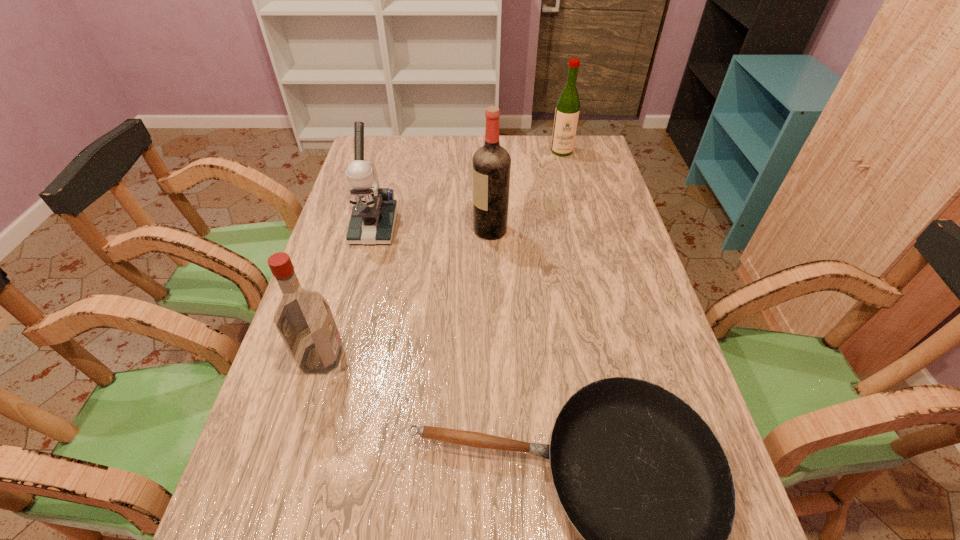
At what (x,y) coordinates should I click in order to perform the action: click on the second liquor from left to right. Please return your answer as a coordinate pair (x, y). Looking at the image, I should click on (491, 164).

Locate an element on the screen. the farthest object is located at coordinates (567, 111).

At what (x,y) coordinates should I click in order to perform the action: click on the farthest liquor. Please return your answer as a coordinate pair (x, y). Looking at the image, I should click on (567, 111).

What are the coordinates of `microscope` in the screenshot? It's located at (374, 213).

The width and height of the screenshot is (960, 540). Find the location of `the nearest liquor`. the nearest liquor is located at coordinates (303, 318).

You are a GUI agent. You are given a task and a screenshot of the screen. Output one action in this format:
    pyautogui.click(x=<x>, y=<y>)
    Task: Click on the second nearest object
    
    Given the screenshot: What is the action you would take?
    pyautogui.click(x=303, y=318)

Identify the location of vacant space located 0.120m on the front-facing side of the second liquor from right to left. (433, 230).

I want to click on vacant area situated on the front-facing side of the second liquor from right to left, so click(x=457, y=230).

I want to click on vacant area located on the front-facing side of the second liquor from right to left, so [x=399, y=230].

Locate an element on the screen. vacant space located 0.330m on the label of the farthest object is located at coordinates (577, 213).